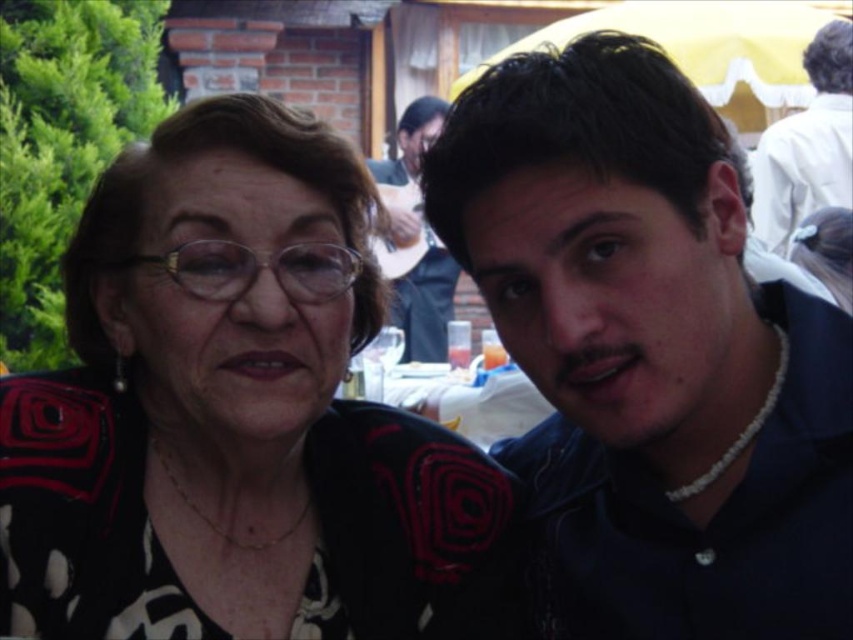
You are at an outdoor event and see the smooth black shirt at right and the white plastic table at center. Which object is closer to the left side of the scene?

The smooth black shirt at right is positioned on the left side of the white plastic table at center, so it is closer to the left side of the scene.